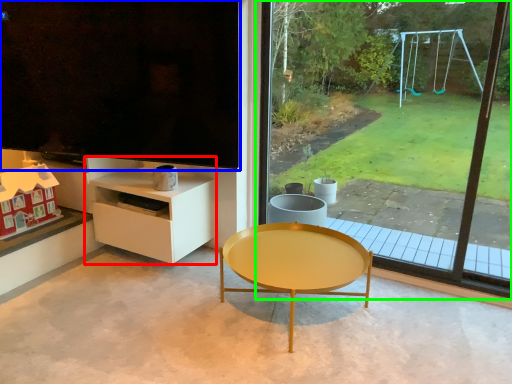
Question: Which object is the farthest from shelf (highlighted by a red box)? Choose among these: window screen (highlighted by a blue box) or window (highlighted by a green box).

Choices:
 (A) window screen
 (B) window

Answer: (B)